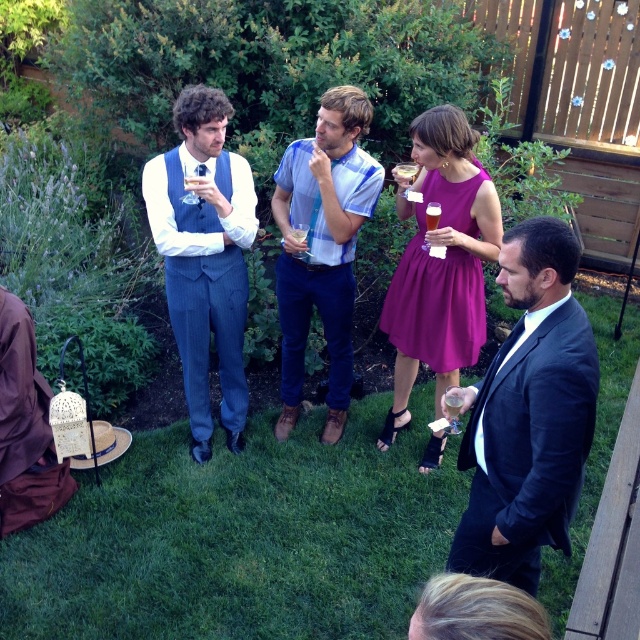
Between pinstriped suit at center and blue striped shirt at center, which one is positioned higher?

blue striped shirt at center

Between point (241, 442) and point (342, 323), which one is positioned in front?

Positioned in front is point (342, 323).

Locate an element on the screen. This screenshot has height=640, width=640. pinstriped suit at center is located at coordinates (204, 257).

Which is above, dark suit at center or purple satin dress at center?

purple satin dress at center is higher up.

Who is positioned more to the left, dark suit at center or purple satin dress at center?

purple satin dress at center is more to the left.

Does point (486, 410) come farther from viewer compared to point (477, 273)?

No, it is not.

Find the location of a particular element. The width and height of the screenshot is (640, 640). dark suit at center is located at coordinates (529, 413).

Is point (228, 376) behind point (433, 289)?

That is True.

Is pinstriped suit at center positioned at the back of purple satin dress at center?

Yes.

Is point (184, 369) closer to viewer compared to point (465, 337)?

That is False.

Identify the location of pinstriped suit at center. (204, 257).